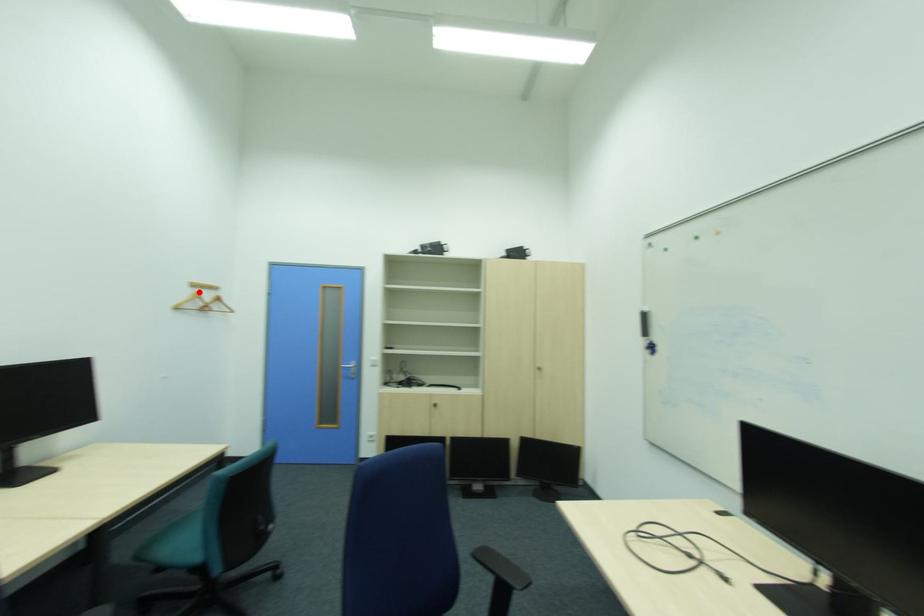
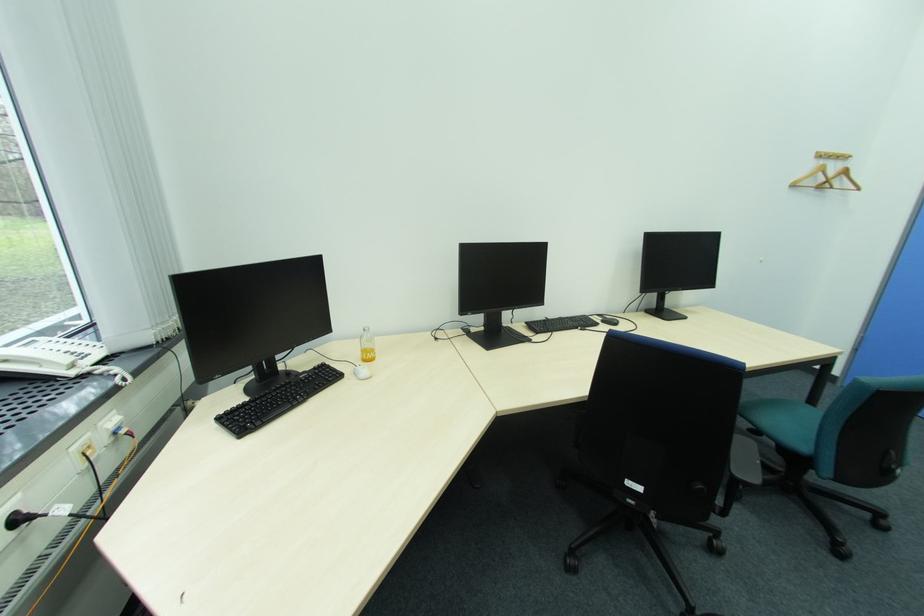
Locate, in the second image, the point that corresponds to the highlighted location in the first image.

(819, 164)